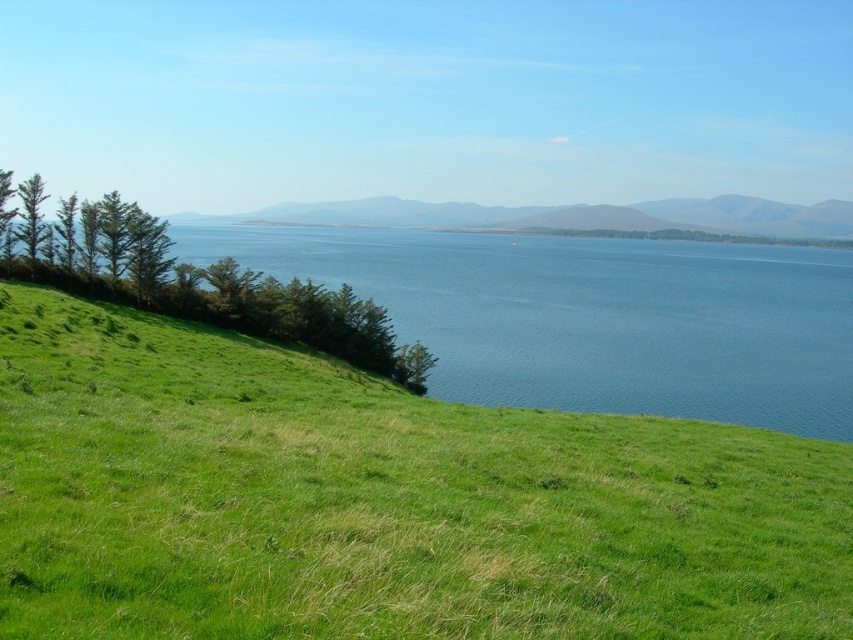
Question: Is green grassy hillside at lower left further to camera compared to blue water at left?

Choices:
 (A) yes
 (B) no

Answer: (B)

Question: Which point is closer to the camera taking this photo?

Choices:
 (A) (329, 529)
 (B) (553, 296)

Answer: (A)

Question: Which point is closer to the camera?

Choices:
 (A) blue water at left
 (B) green grassy hillside at lower left

Answer: (B)

Question: Can you confirm if green grassy hillside at lower left is positioned above blue water at left?

Choices:
 (A) no
 (B) yes

Answer: (A)

Question: Can you confirm if green grassy hillside at lower left is positioned below blue water at left?

Choices:
 (A) yes
 (B) no

Answer: (A)